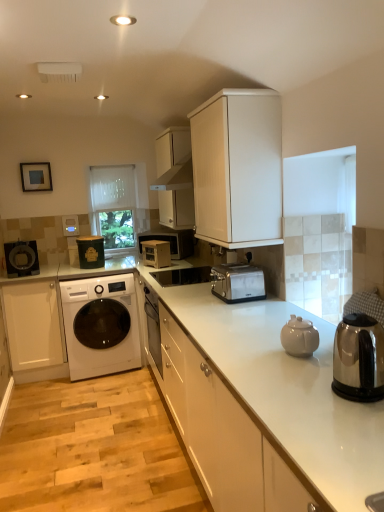
Find the location of a particular element. This screenshot has width=384, height=512. vacant area that lies in front of satin silver toaster at center is located at coordinates (247, 309).